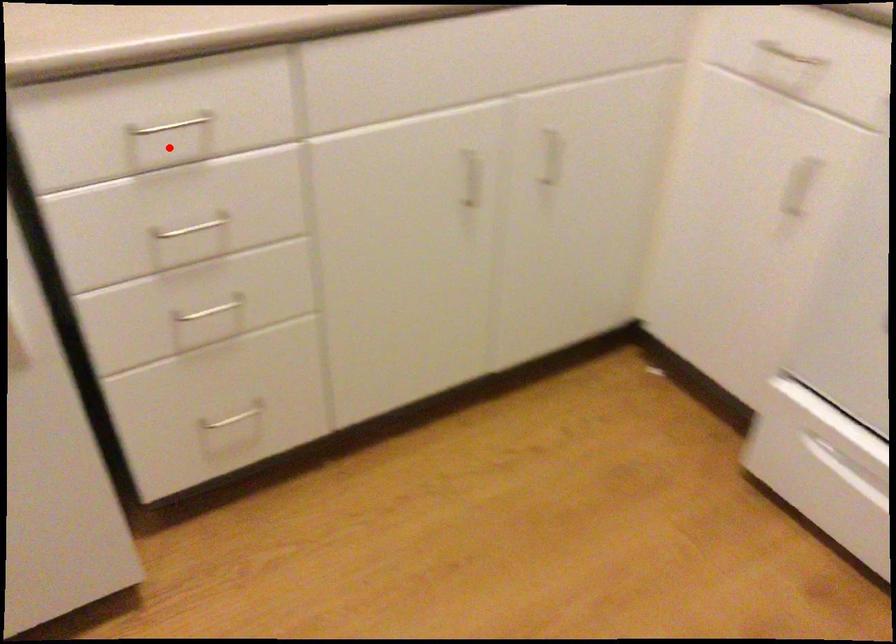
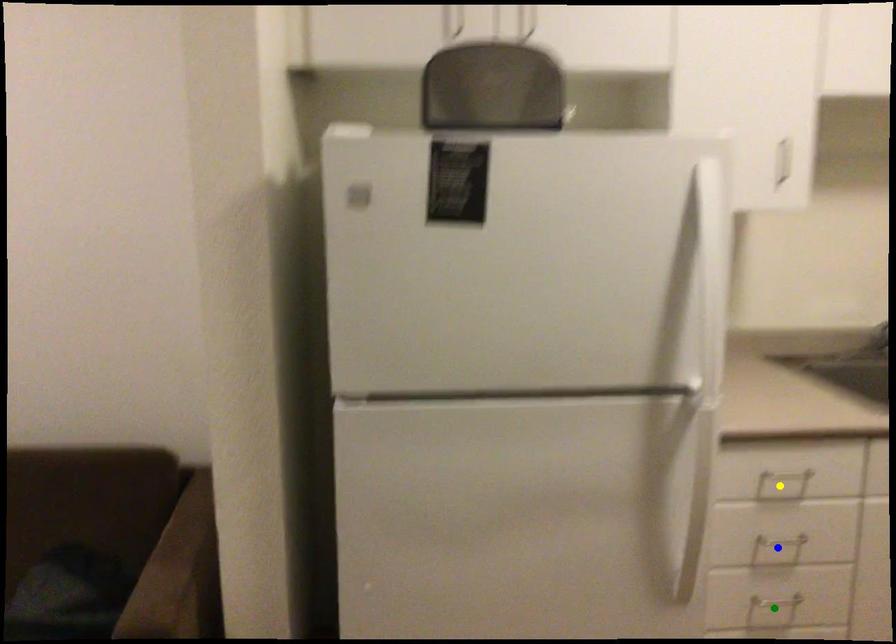
Question: I am providing you with two images of the same scene from different viewpoints. A red point is marked on the first image. You are given multiple points on the second image. Which mark in image 2 goes with the point in image 1?

Choices:
 (A) yellow point
 (B) green point
 (C) blue point

Answer: (A)